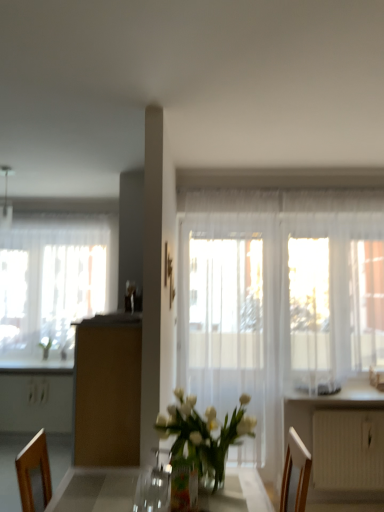
Question: Is metallic silver lamp at upper left taller or shorter than translucent glass vase at center?

Choices:
 (A) tall
 (B) short

Answer: (A)

Question: From the image's perspective, is metallic silver lamp at upper left above or below translucent glass vase at center?

Choices:
 (A) below
 (B) above

Answer: (B)

Question: Estimate the real-world distances between objects in this image. Which object is farther from the translucent fabric screen door at center?

Choices:
 (A) white textured radiator at lower right
 (B) brown matte cabinet at center
 (C) translucent glass window at left
 (D) metallic silver lamp at upper left
 (E) white glossy counter top at lower right

Answer: (D)

Question: Which object is positioned closest to the translucent glass vase at center?

Choices:
 (A) brown matte cabinet at center
 (B) wooden picture frame at center
 (C) white textured radiator at lower right
 (D) white glossy counter top at lower right
 (E) translucent glass window at left

Answer: (A)